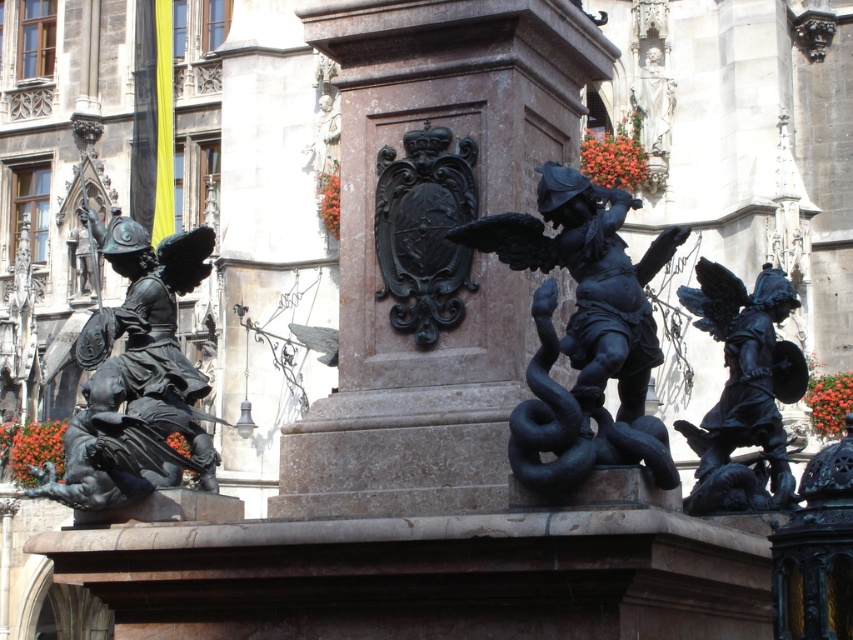
You are an architect examining the historical monument. You need to place a new decorative element exactly at the center of the monument. The polished stone pillar at center is at coordinates point 0.384, 0.530. Is the pillar located at the exact center of the monument?

The polished stone pillar at center is located at point (x=451, y=244). Since the monument is centered around this pillar, it is indeed at the exact center of the monument.

You are an art student analyzing the sculptures on the monument. You notice two figures, the polished bronze angel at right and the polished bronze figure at center. Which of these two figures has a greater height?

The polished bronze angel at right is taller than the polished bronze figure at center.